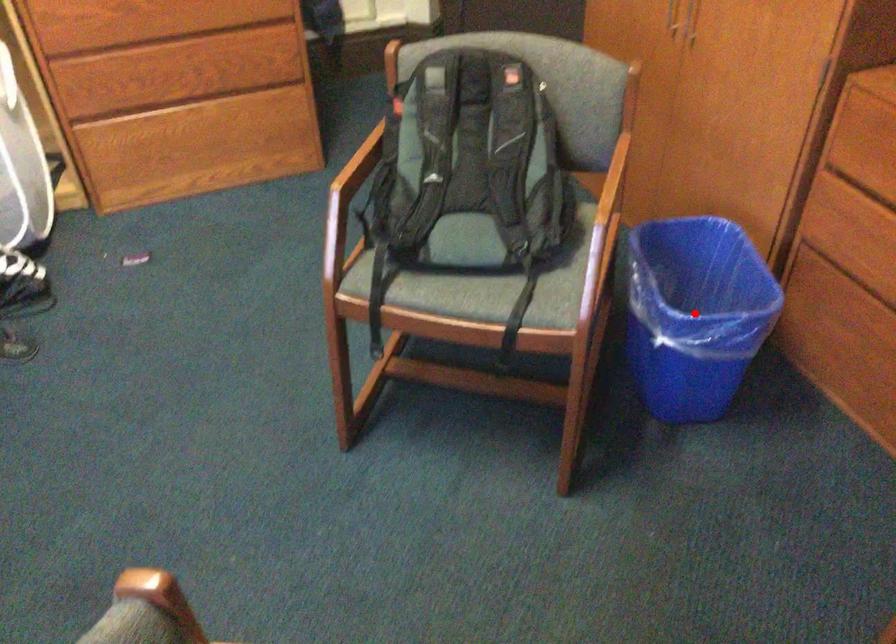
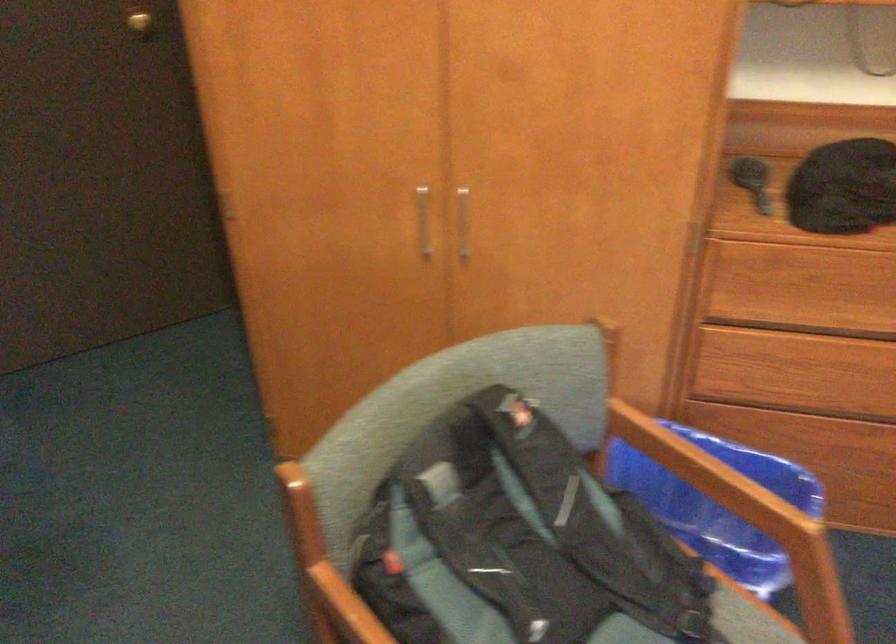
Question: I am providing you with two images of the same scene from different viewpoints. A red point is marked on the first image. Can you still see the location of the red point in image 2?

Choices:
 (A) Yes
 (B) No

Answer: (B)